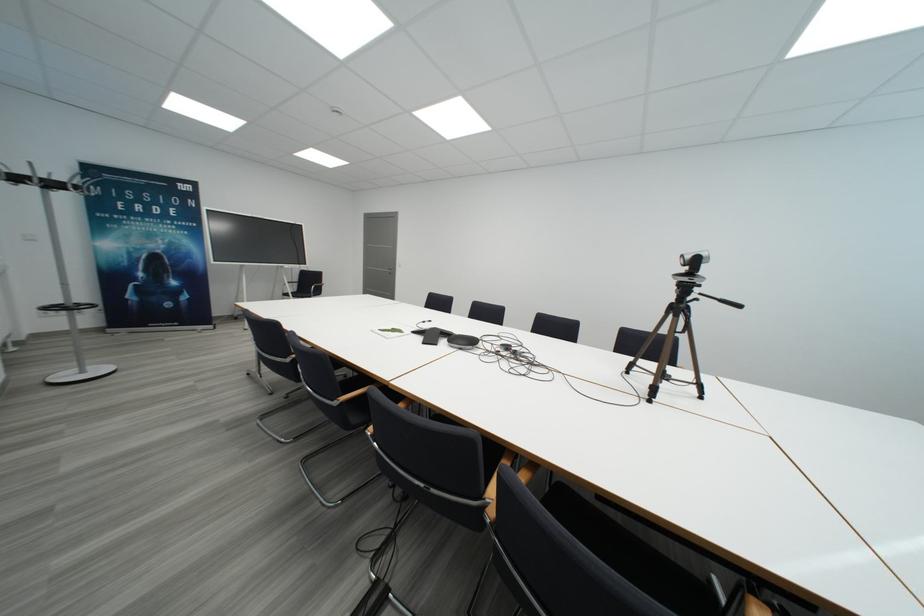
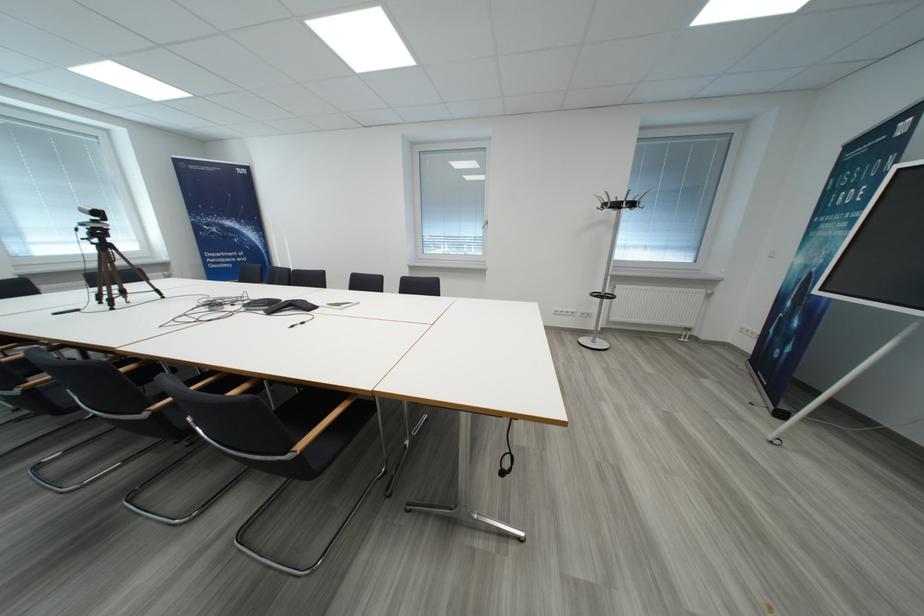
Question: I am providing you with two images of the same scene from different viewpoints. Please identify which objects are invisible in image2.

Choices:
 (A) green booklet
 (B) patterned mug handle
 (C) tripod pan handle
 (D) coat rack hook

Answer: (C)